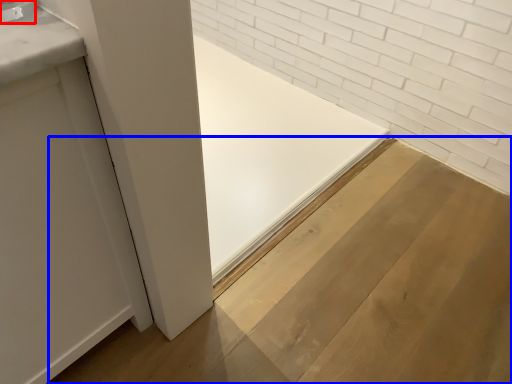
Question: Among these objects, which one is nearest to the camera, faucet (highlighted by a red box) or plywood (highlighted by a blue box)?

Choices:
 (A) faucet
 (B) plywood

Answer: (A)